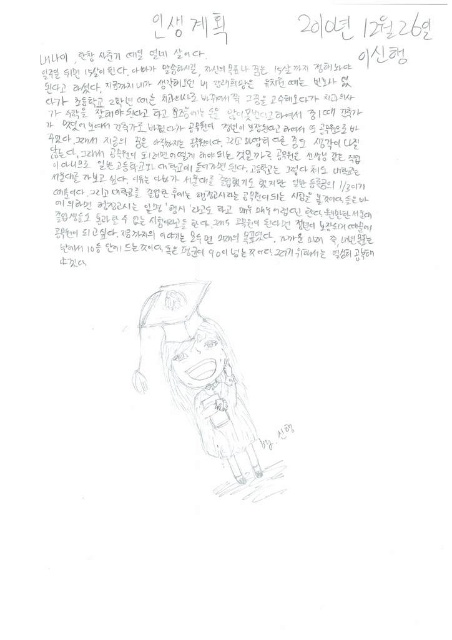
Question: Can you confirm if black paper at center is positioned to the right of sketchy pencil drawing of a person at center?

Choices:
 (A) no
 (B) yes

Answer: (B)

Question: Which object is closer to the camera taking this photo?

Choices:
 (A) sketchy pencil drawing of a person at center
 (B) black paper at center

Answer: (B)

Question: Is the position of black paper at center more distant than that of sketchy pencil drawing of a person at center?

Choices:
 (A) no
 (B) yes

Answer: (A)

Question: Is black paper at center further to camera compared to sketchy pencil drawing of a person at center?

Choices:
 (A) yes
 (B) no

Answer: (B)

Question: Which object appears farthest from the camera in this image?

Choices:
 (A) black paper at center
 (B) sketchy pencil drawing of a person at center

Answer: (B)